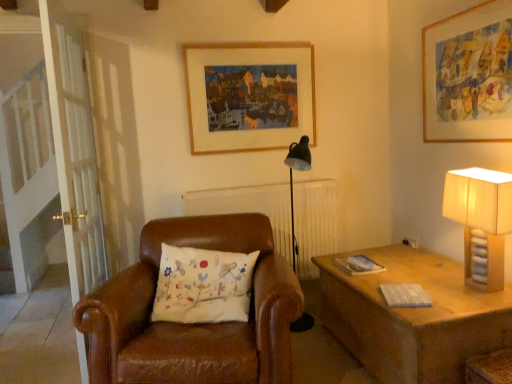
Image resolution: width=512 pixels, height=384 pixels. Describe the element at coordinates (481, 221) in the screenshot. I see `beige fabric lampshade at right` at that location.

The image size is (512, 384). In order to click on beige fabric lampshade at right in this screenshot , I will do `click(481, 221)`.

Measure the distance between white embroidered pillow at center and camera.

They are 2.08 meters apart.

What do you see at coordinates (203, 285) in the screenshot? This screenshot has height=384, width=512. I see `white embroidered pillow at center` at bounding box center [203, 285].

What is the approximate width of wooden picture frame at upper right, the second picture frame positioned from the back?

wooden picture frame at upper right, the second picture frame positioned from the back, is 1.28 inches wide.

Locate an element on the screen. This screenshot has height=384, width=512. wooden picture frame at upper center, which is the 1th picture frame in left-to-right order is located at coordinates (249, 95).

Does beige fabric lampshade at right lie behind white wooden screen door at left?

That is False.

Do you think beige fabric lampshade at right is within white wooden screen door at left, or outside of it?

beige fabric lampshade at right lies outside white wooden screen door at left.

How much distance is there between beige fabric lampshade at right and white wooden screen door at left?

beige fabric lampshade at right and white wooden screen door at left are 1.95 meters apart.

Between point (475, 232) and point (77, 49), which one is positioned behind?

Point (77, 49)

Is white embroidered pillow at center at the back of wooden picture frame at upper center, the 2th picture frame when ordered from front to back?

No, wooden picture frame at upper center, the 2th picture frame when ordered from front to back, is not facing away from white embroidered pillow at center.

Considering the sizes of wooden picture frame at upper center, the 1th picture frame from the back, and white embroidered pillow at center in the image, is wooden picture frame at upper center, the 1th picture frame from the back, taller or shorter than white embroidered pillow at center?

wooden picture frame at upper center, the 1th picture frame from the back, is taller than white embroidered pillow at center.

Considering the relative sizes of wooden picture frame at upper center, the 1th picture frame from the back, and white embroidered pillow at center in the image provided, is wooden picture frame at upper center, the 1th picture frame from the back, smaller than white embroidered pillow at center?

Correct, wooden picture frame at upper center, the 1th picture frame from the back, occupies less space than white embroidered pillow at center.

Is wooden picture frame at upper center, the 2th picture frame when ordered from front to back, located outside white embroidered pillow at center?

wooden picture frame at upper center, the 2th picture frame when ordered from front to back, is positioned outside white embroidered pillow at center.

Is point (164, 320) more distant than point (446, 124)?

No, (164, 320) is closer to viewer.

Is white embroidered pillow at center smaller than wooden picture frame at upper right, which ranks as the first picture frame in right-to-left order?

No, white embroidered pillow at center is not smaller than wooden picture frame at upper right, which ranks as the first picture frame in right-to-left order.

There is a white embroidered pillow at center. Identify the location of the 1st picture frame above it (from the image's perspective). click(469, 75).

Considering the sizes of objects white embroidered pillow at center and wooden picture frame at upper right, the second picture frame viewed from the left, in the image provided, who is thinner, white embroidered pillow at center or wooden picture frame at upper right, the second picture frame viewed from the left,?

wooden picture frame at upper right, the second picture frame viewed from the left, is thinner.

From the image's perspective, between white wooden screen door at left and beige fabric lampshade at right, who is located below?

beige fabric lampshade at right appears lower in the image.

Which is behind, white wooden screen door at left or beige fabric lampshade at right?

white wooden screen door at left is behind.

Based on their sizes in the image, would you say white wooden screen door at left is bigger or smaller than beige fabric lampshade at right?

Considering their sizes, white wooden screen door at left takes up more space than beige fabric lampshade at right.

In terms of height, does white wooden screen door at left look taller or shorter compared to beige fabric lampshade at right?

white wooden screen door at left is taller than beige fabric lampshade at right.

Would you consider wooden picture frame at upper right, which ranks as the first picture frame in right-to-left order, to be distant from beige fabric lampshade at right?

Actually, wooden picture frame at upper right, which ranks as the first picture frame in right-to-left order, and beige fabric lampshade at right are a little close together.

Considering the sizes of wooden picture frame at upper right, which ranks as the first picture frame in right-to-left order, and beige fabric lampshade at right in the image, is wooden picture frame at upper right, which ranks as the first picture frame in right-to-left order, bigger or smaller than beige fabric lampshade at right?

Clearly, wooden picture frame at upper right, which ranks as the first picture frame in right-to-left order, is smaller in size than beige fabric lampshade at right.

From the picture: Is wooden picture frame at upper right, which is counted as the first picture frame, starting from the front, further to the viewer compared to beige fabric lampshade at right?

Yes, wooden picture frame at upper right, which is counted as the first picture frame, starting from the front, is further from the camera.

Does point (466, 126) come in front of point (480, 192)?

No, it is not.

Which object is thinner, wooden picture frame at upper center, which is the second picture frame from right to left, or beige fabric lampshade at right?

wooden picture frame at upper center, which is the second picture frame from right to left.

Is wooden picture frame at upper center, the 2th picture frame when ordered from front to back, far from beige fabric lampshade at right?

Indeed, wooden picture frame at upper center, the 2th picture frame when ordered from front to back, is not near beige fabric lampshade at right.

From a real-world perspective, is wooden picture frame at upper center, the 1th picture frame from the back, located higher than beige fabric lampshade at right?

Correct, in the physical world, wooden picture frame at upper center, the 1th picture frame from the back, is higher than beige fabric lampshade at right.

From the image's perspective, is white wooden screen door at left under wooden picture frame at upper right, the second picture frame viewed from the left?

Correct, white wooden screen door at left appears lower than wooden picture frame at upper right, the second picture frame viewed from the left, in the image.

Is point (68, 259) positioned before point (480, 135)?

Yes, point (68, 259) is closer to viewer.

From the picture: Is white wooden screen door at left inside or outside of wooden picture frame at upper right, which is counted as the first picture frame, starting from the front?

white wooden screen door at left cannot be found inside wooden picture frame at upper right, which is counted as the first picture frame, starting from the front.

The width and height of the screenshot is (512, 384). In order to click on screen door above the beige fabric lampshade at right (from the image's perspective) in this screenshot , I will do `click(76, 157)`.

From a real-world perspective, count 2nd picture frames upward from the white embroidered pillow at center and point to it. Please provide its 2D coordinates.

[(249, 95)]

Considering their positions, is white wooden screen door at left positioned further to wooden picture frame at upper center, which is the second picture frame from right to left, than white embroidered pillow at center?

Among the two, white embroidered pillow at center is located further to wooden picture frame at upper center, which is the second picture frame from right to left.

Looking at the image, which one is located closer to white embroidered pillow at center, wooden picture frame at upper right, the second picture frame positioned from the back, or white wooden screen door at left?

white wooden screen door at left is positioned closer to the anchor white embroidered pillow at center.

Which object lies further to the anchor point wooden picture frame at upper center, which is the second picture frame from right to left, white wooden screen door at left or wooden picture frame at upper right, the second picture frame viewed from the left?

wooden picture frame at upper right, the second picture frame viewed from the left, lies further to wooden picture frame at upper center, which is the second picture frame from right to left, than the other object.

From the image, which object appears to be farther from white wooden screen door at left, wooden picture frame at upper center, which is the 1th picture frame in left-to-right order, or beige fabric lampshade at right?

beige fabric lampshade at right lies further to white wooden screen door at left than the other object.

Looking at the image, which one is located closer to wooden picture frame at upper right, which ranks as the first picture frame in right-to-left order, white embroidered pillow at center or wooden picture frame at upper center, which is the second picture frame from right to left?

wooden picture frame at upper center, which is the second picture frame from right to left.

From the image, which object appears to be nearer to wooden picture frame at upper right, which ranks as the first picture frame in right-to-left order, beige fabric lampshade at right or white embroidered pillow at center?

beige fabric lampshade at right is closer to wooden picture frame at upper right, which ranks as the first picture frame in right-to-left order.

When comparing their distances from white embroidered pillow at center, does white wooden screen door at left or beige fabric lampshade at right seem closer?

white wooden screen door at left.

Which object lies nearer to the anchor point beige fabric lampshade at right, white wooden screen door at left or wooden picture frame at upper right, the second picture frame positioned from the back?

wooden picture frame at upper right, the second picture frame positioned from the back, lies closer to beige fabric lampshade at right than the other object.

Locate an element on the screen. This screenshot has height=384, width=512. picture frame located between white embroidered pillow at center and beige fabric lampshade at right in the left-right direction is located at coordinates (249, 95).

Where is `table lamp situated between white wooden screen door at left and wooden picture frame at upper right, the second picture frame viewed from the left, from left to right`? table lamp situated between white wooden screen door at left and wooden picture frame at upper right, the second picture frame viewed from the left, from left to right is located at coordinates (481, 221).

Find the location of `picture frame situated between white wooden screen door at left and beige fabric lampshade at right from left to right`. picture frame situated between white wooden screen door at left and beige fabric lampshade at right from left to right is located at coordinates point(249,95).

You are a GUI agent. You are given a task and a screenshot of the screen. Output one action in this format:
    pyautogui.click(x=<x>, y=<y>)
    Task: Click on the pillow located between white wooden screen door at left and beige fabric lampshade at right in the left-right direction
    Image resolution: width=512 pixels, height=384 pixels.
    Given the screenshot: What is the action you would take?
    pyautogui.click(x=203, y=285)